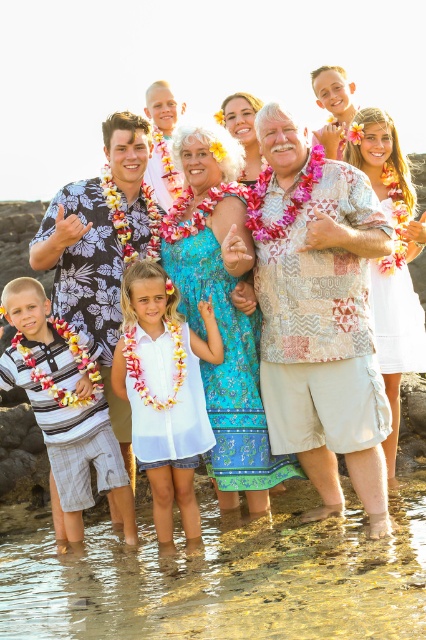
Does clear water at lower center have a larger size compared to white cotton shirt at center?

Yes, clear water at lower center is bigger than white cotton shirt at center.

Who is shorter, clear water at lower center or white cotton shirt at center?

clear water at lower center

Based on the photo, who is more forward, (x=213, y=563) or (x=195, y=534)?

Positioned in front is point (x=213, y=563).

The height and width of the screenshot is (640, 426). I want to click on clear water at lower center, so click(x=222, y=577).

Who is taller, clear water at lower center or striped cotton shirt at lower left?

striped cotton shirt at lower left is taller.

Is the position of clear water at lower center more distant than that of striped cotton shirt at lower left?

No, it is not.

Who is more distant from viewer, (172, 620) or (89, 435)?

The point (89, 435) is behind.

What are the coordinates of `clear water at lower center` in the screenshot? It's located at (222, 577).

Between point (161, 468) and point (60, 449), which one is positioned behind?

The point (60, 449) is more distant.

Is white cotton shirt at center to the right of striped cotton shirt at lower left from the viewer's perspective?

Indeed, white cotton shirt at center is positioned on the right side of striped cotton shirt at lower left.

Image resolution: width=426 pixels, height=640 pixels. I want to click on white cotton shirt at center, so click(x=164, y=390).